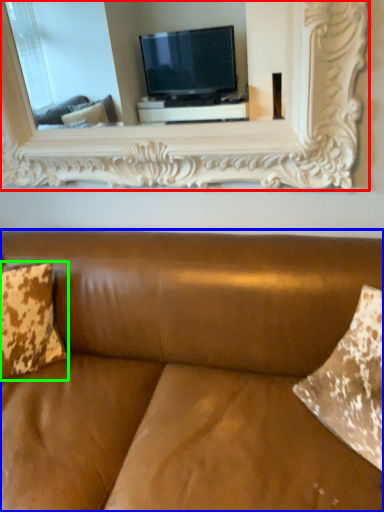
Question: Based on their relative distances, which object is farther from picture frame (highlighted by a red box)? Choose from studio couch (highlighted by a blue box) and pillow (highlighted by a green box).

Choices:
 (A) studio couch
 (B) pillow

Answer: (B)